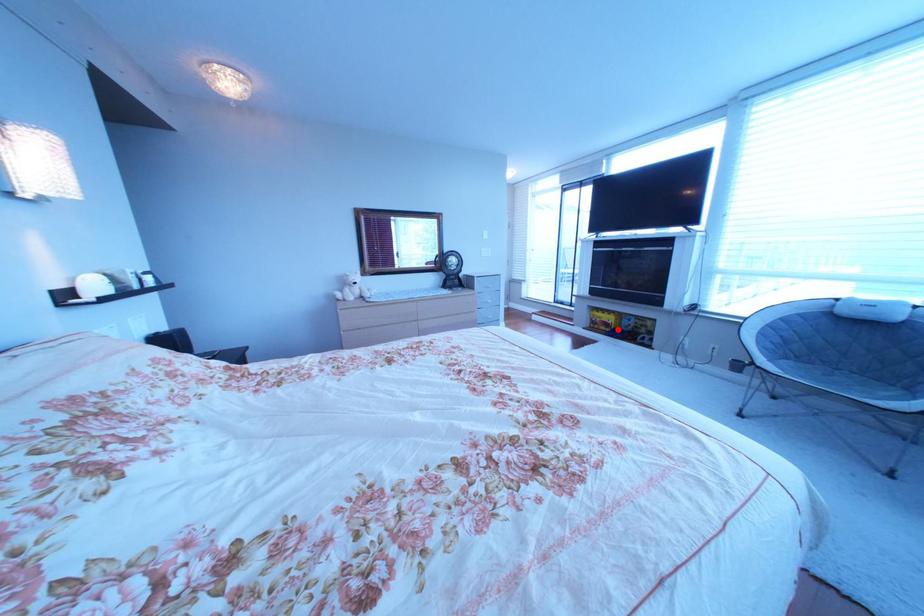
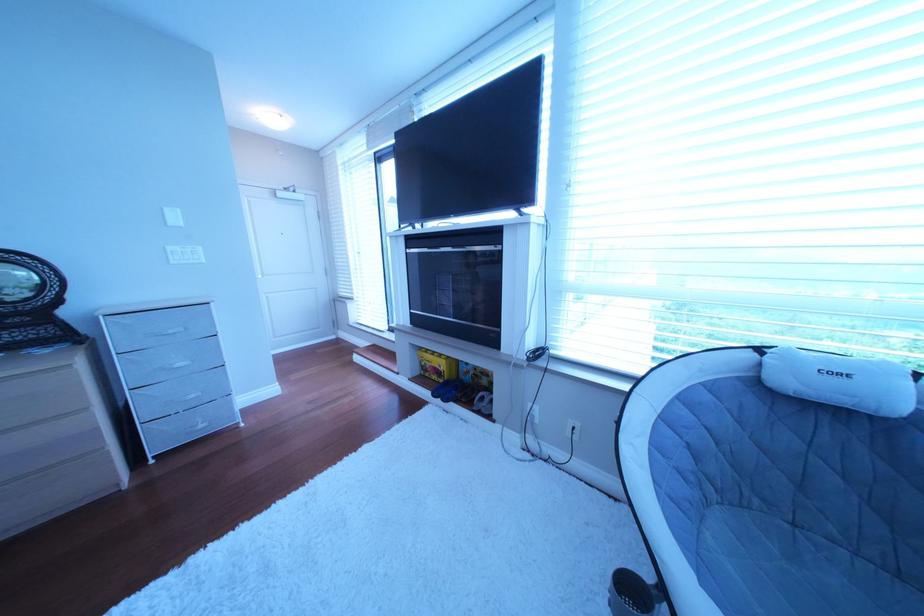
Question: I am providing you with two images of the same scene from different viewpoints. Image1 has a red point marked. In image2, the corresponding 3D location appears at what relative position? Reply with the corresponding letter.

Choices:
 (A) Closer
 (B) Farther

Answer: (B)